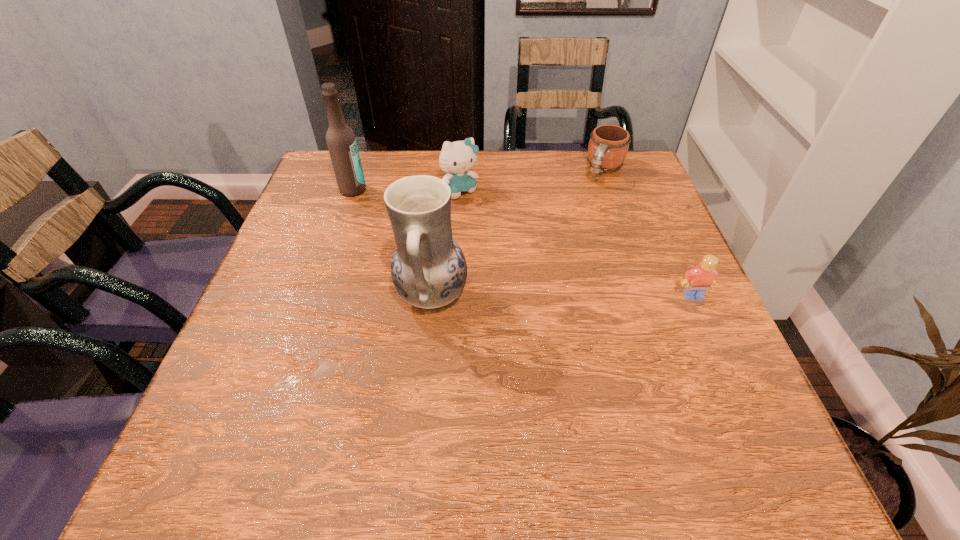
Image resolution: width=960 pixels, height=540 pixels. I want to click on pottery, so click(x=428, y=268).

At what (x,y) coordinates should I click in order to perform the action: click on Lego. Please return your answer as a coordinate pair (x, y). Image resolution: width=960 pixels, height=540 pixels. Looking at the image, I should click on (697, 281).

The height and width of the screenshot is (540, 960). I want to click on kitten, so click(457, 157).

Identify the location of the leftmost object. Image resolution: width=960 pixels, height=540 pixels. (341, 141).

You are a GUI agent. You are given a task and a screenshot of the screen. Output one action in this format:
    pyautogui.click(x=<x>, y=<y>)
    Task: Click on the mug
    This screenshot has height=540, width=960.
    Given the screenshot: What is the action you would take?
    pyautogui.click(x=608, y=146)

Where is `free space located 0.140m on the front of the pottery`? The width and height of the screenshot is (960, 540). free space located 0.140m on the front of the pottery is located at coordinates (421, 403).

Locate an element on the screen. blank space located 0.100m on the front-facing side of the Lego is located at coordinates (712, 341).

Locate an element on the screen. vacant space positioned on the face of the kitten is located at coordinates (540, 279).

What are the coordinates of `vacant space located 0.400m on the face of the kitten` in the screenshot? It's located at (562, 304).

Where is `free space located 0.160m on the face of the kitten`? free space located 0.160m on the face of the kitten is located at coordinates (501, 237).